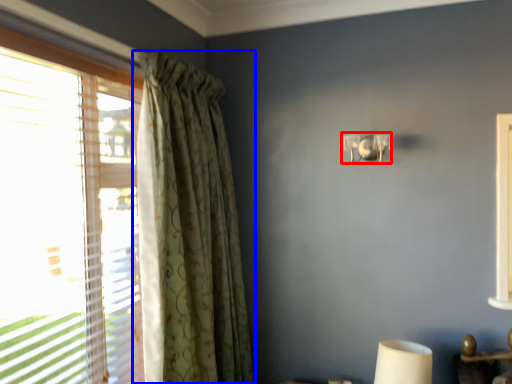
Question: Which object is closer to the camera taking this photo, lamp (highlighted by a red box) or curtain (highlighted by a blue box)?

Choices:
 (A) lamp
 (B) curtain

Answer: (B)